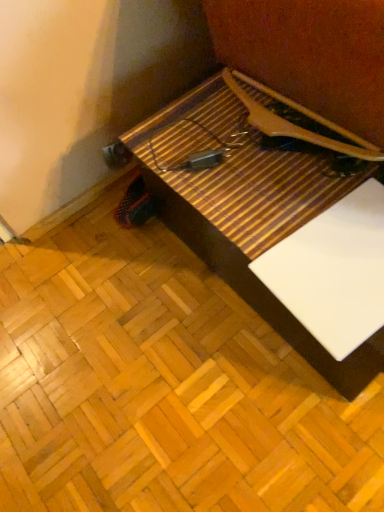
At what (x,y) coordinates should I click in order to perform the action: click on vacant space behind white matte paper at lower right. Please return your answer as a coordinate pair (x, y). Image resolution: width=384 pixels, height=512 pixels. Looking at the image, I should click on (287, 183).